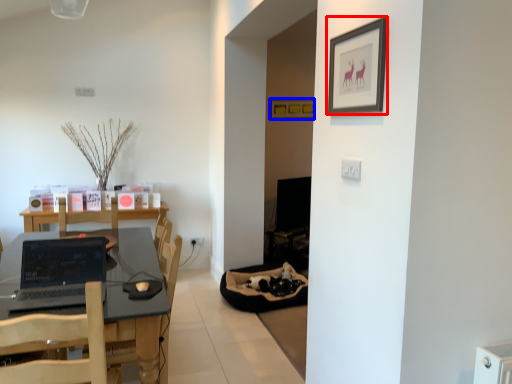
Question: Which point is further to the camera, picture frame (highlighted by a red box) or picture frame (highlighted by a blue box)?

Choices:
 (A) picture frame
 (B) picture frame

Answer: (B)